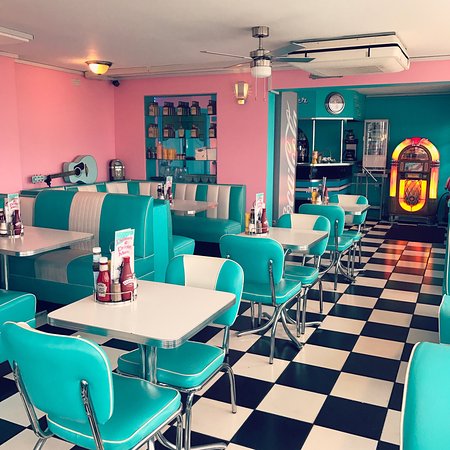
Where is `chair backrest`? chair backrest is located at coordinates (45, 369), (218, 283), (255, 257), (299, 223), (320, 207), (351, 199).